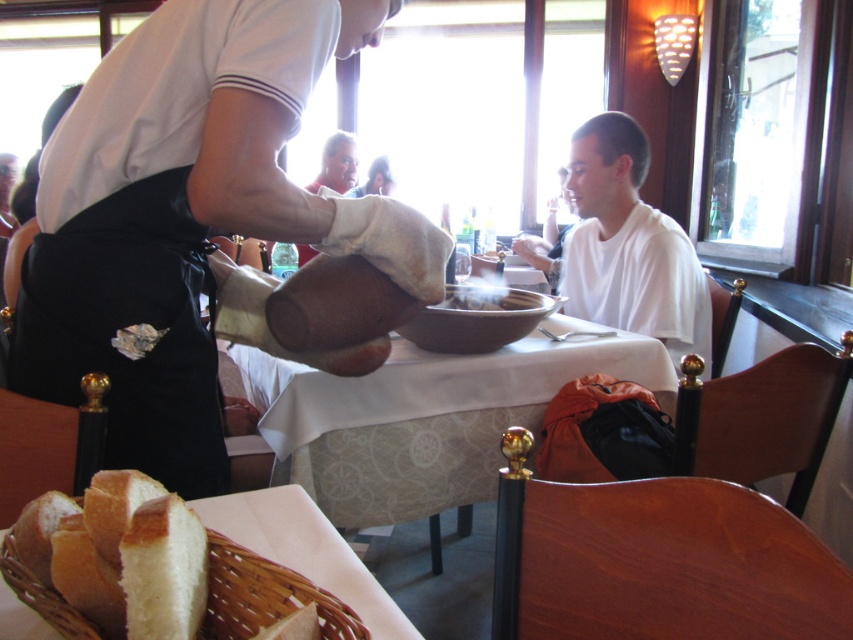
Does white fabric table at center have a larger size compared to white wicker basket at lower left?

Correct, white fabric table at center is larger in size than white wicker basket at lower left.

From the picture: Between white fabric table at center and white wicker basket at lower left, which one appears on the right side from the viewer's perspective?

Positioned to the right is white fabric table at center.

Who is more forward, (488,381) or (297,499)?

Point (297,499) is more forward.

Where is `white fabric table at center`? white fabric table at center is located at coordinates (424, 419).

Does white matte shirt at upper center have a greater width compared to white matte shirt at center?

Indeed, white matte shirt at upper center has a greater width compared to white matte shirt at center.

Who is more distant from viewer, (177,44) or (569,301)?

Positioned behind is point (569,301).

Locate an element on the screen. The height and width of the screenshot is (640, 853). white matte shirt at upper center is located at coordinates (158, 289).

Locate an element on the screen. This screenshot has width=853, height=640. white matte shirt at upper center is located at coordinates (158, 289).

How far apart are white matte shirt at upper center and white fabric table at center?

23.12 inches

What do you see at coordinates (158, 289) in the screenshot?
I see `white matte shirt at upper center` at bounding box center [158, 289].

Find the location of a particular element. This screenshot has height=640, width=853. white matte shirt at upper center is located at coordinates (158, 289).